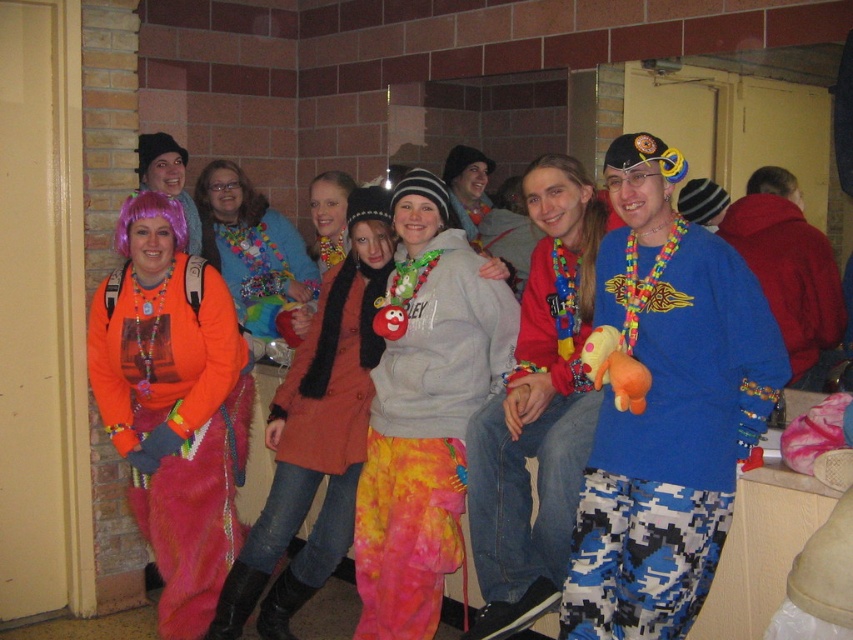
You are organizing a photo shoot and need to ensure that the camouflage pants at center and the matte orange sweater at center are visible in the final image. Given their sizes, which of the two items might require more careful framing to ensure visibility?

The camouflage pants at center has a lesser width compared to the matte orange sweater at center, so the camouflage pants at center might require more careful framing to ensure visibility due to its smaller size.